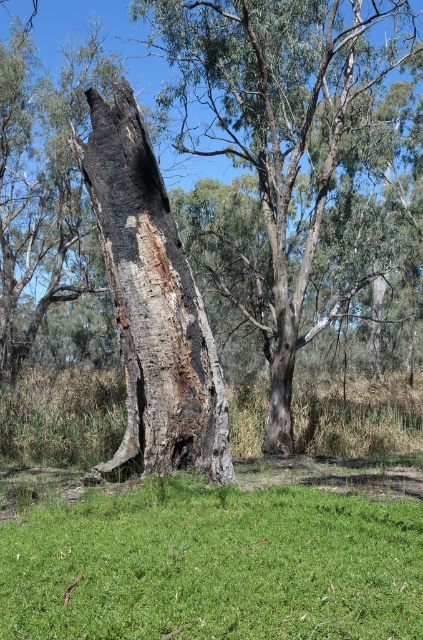
Question: Among these objects, which one is farthest from the camera?

Choices:
 (A) green grass at center
 (B) charcoal rough bark tree trunk at center
 (C) charcoal bark tree at left

Answer: (C)

Question: In this image, where is green grass at center located relative to charcoal bark tree at left?

Choices:
 (A) left
 (B) right

Answer: (A)

Question: Which object is positioned closest to the charcoal bark tree at left?

Choices:
 (A) green grass at center
 (B) charcoal rough bark tree trunk at center

Answer: (B)

Question: Can you confirm if charcoal bark tree at left is positioned above charcoal rough bark tree trunk at center?

Choices:
 (A) no
 (B) yes

Answer: (B)

Question: Based on their relative distances, which object is nearer to the charcoal rough bark tree trunk at center?

Choices:
 (A) charcoal bark tree at left
 (B) green grass at center

Answer: (B)

Question: Can you confirm if charcoal bark tree at left is positioned below charcoal rough bark tree trunk at center?

Choices:
 (A) yes
 (B) no

Answer: (B)